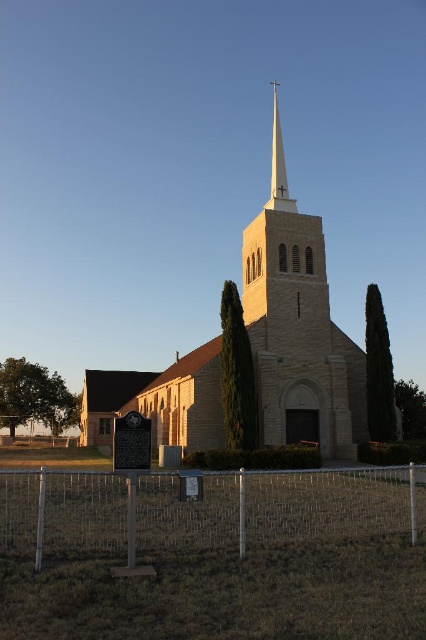
Question: Among these objects, which one is farthest from the camera?

Choices:
 (A) beige stone church at center
 (B) green textured tree at right

Answer: (B)

Question: Can you confirm if green leafy tree at lower left is bigger than green leafy tree at lower right?

Choices:
 (A) no
 (B) yes

Answer: (B)

Question: Which object is positioned farthest from the green textured tree at right?

Choices:
 (A) white smooth steeple at center
 (B) green leafy tree at lower left

Answer: (B)

Question: Which of the following is the farthest from the observer?

Choices:
 (A) (14, 369)
 (B) (26, 552)
 (C) (399, 429)

Answer: (A)

Question: Can you confirm if green textured stone tree at center is positioned to the left of green leafy tree at lower right?

Choices:
 (A) no
 (B) yes

Answer: (B)

Question: Is green textured stone tree at center thinner than green leafy tree at lower left?

Choices:
 (A) yes
 (B) no

Answer: (A)